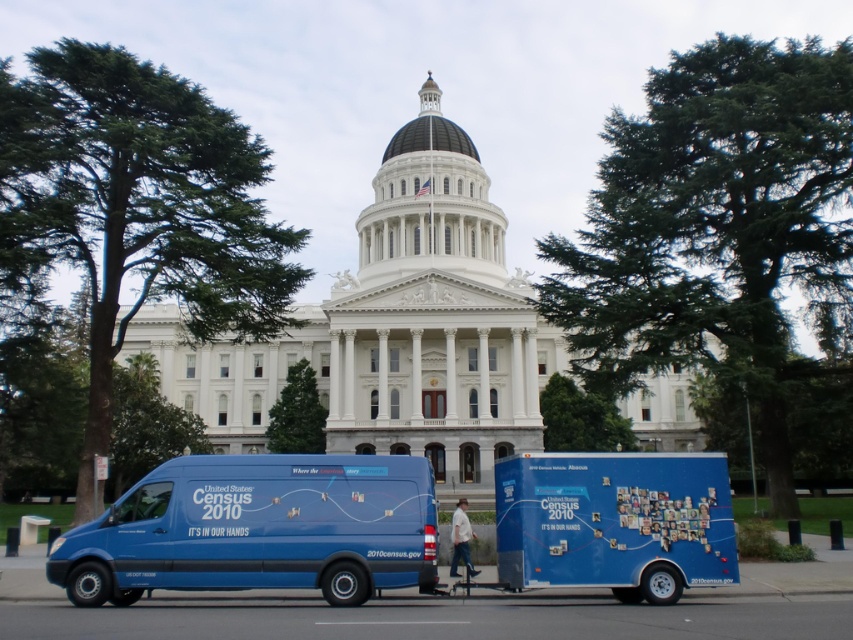
Which is in front, point (375, 504) or point (665, 604)?

Positioned in front is point (665, 604).

Consider the image. Is blue matte van at center below blue matte trailer at lower right?

Yes, blue matte van at center is below blue matte trailer at lower right.

Who is more distant from viewer, [165,493] or [548,540]?

The point [165,493] is behind.

The height and width of the screenshot is (640, 853). Find the location of `blue matte van at center`. blue matte van at center is located at coordinates [x=258, y=529].